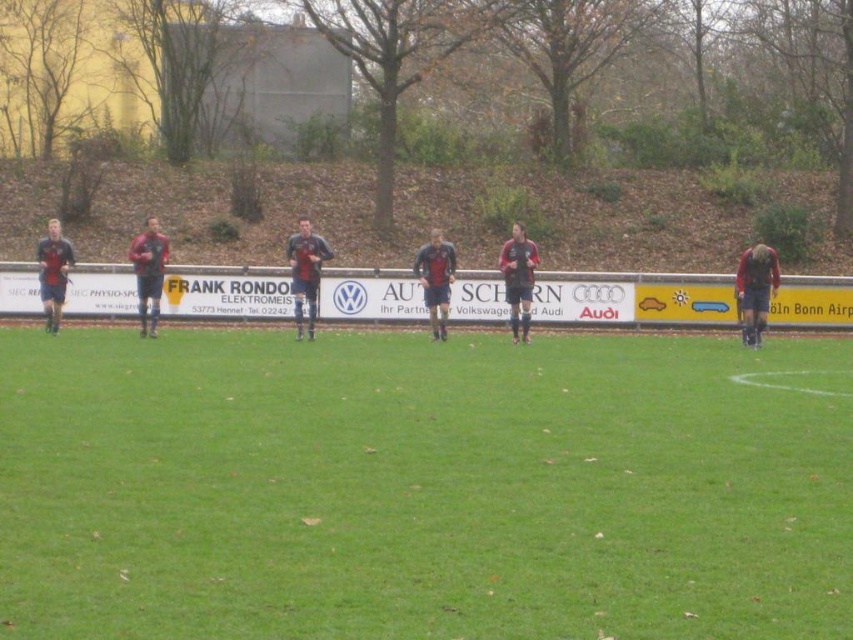
Question: Is green grass at center to the right of matte black jersey at left from the viewer's perspective?

Choices:
 (A) no
 (B) yes

Answer: (B)

Question: Which of the following is the farthest from the observer?

Choices:
 (A) dark blue jersey at center
 (B) matte red jacket at right
 (C) matte red soccer uniforms at center
 (D) matte black soccer player at left

Answer: (D)

Question: Which of the following is the closest to the observer?

Choices:
 (A) (297, 230)
 (B) (136, 266)
 (C) (450, 276)
 (D) (64, 262)

Answer: (D)

Question: Can you confirm if matte black jersey at left is thinner than matte red shirt at center?

Choices:
 (A) no
 (B) yes

Answer: (B)

Question: Which of the following is the closest to the observer?

Choices:
 (A) (308, 268)
 (B) (196, 268)
 (C) (442, 323)

Answer: (A)

Question: Can you confirm if dark blue jersey at center is wider than matte red shirt at center?

Choices:
 (A) no
 (B) yes

Answer: (A)